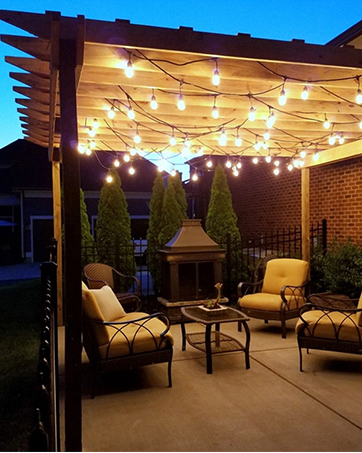
Find the location of a particular element. chair is located at coordinates (133, 327), (118, 288), (267, 290), (322, 318).